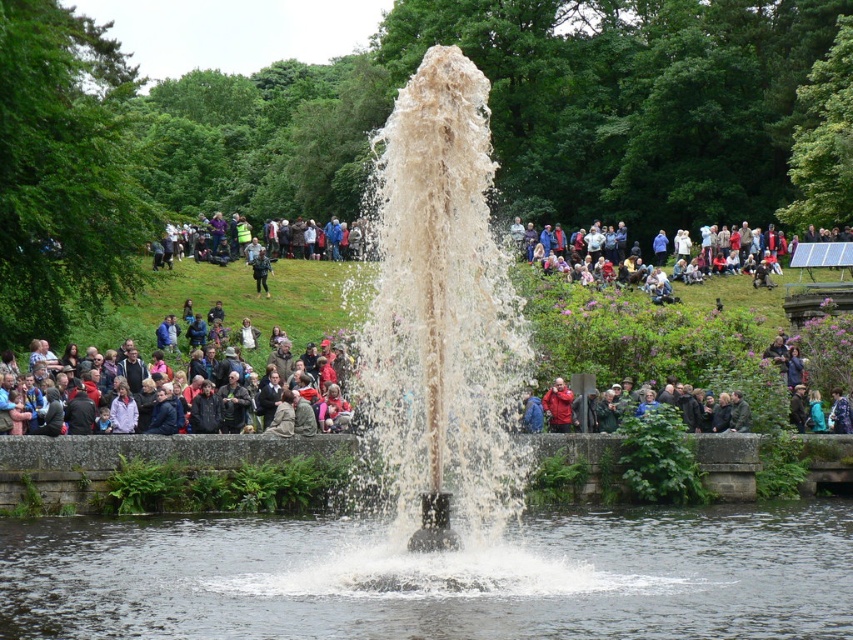
You are standing in the park and want to take a photo of the dark gray jacket at center without including the white frothy water at center in the frame. Which direction should you move to achieve this?

Move to the left so that the dark gray jacket at center is positioned to the right of the white frothy water at center, thus excluding the white frothy water at center from the frame.

You are a photographer standing at the edge of the fountain area. You want to capture a photo that includes both the clear water at center and the dark gray jacket at center. Based on their positions, which object should you adjust your camera angle to focus on first to ensure both are in frame?

The clear water at center is wider than the dark gray jacket at center, so you should focus on the clear water at center first to ensure it fits within the frame.